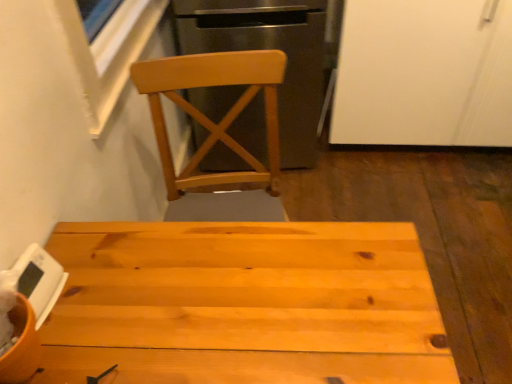
Image resolution: width=512 pixels, height=384 pixels. I want to click on vacant region in front of white matte digital clock at lower left, so click(x=56, y=346).